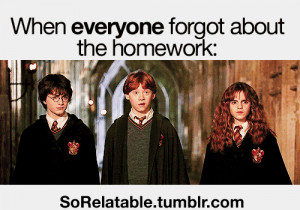
You are a GUI agent. You are given a task and a screenshot of the screen. Output one action in this format:
    pyautogui.click(x=<x>, y=<y>)
    Task: Click on the lights
    The image size is (300, 210).
    Given the screenshot: What is the action you would take?
    pyautogui.click(x=90, y=101), pyautogui.click(x=103, y=111), pyautogui.click(x=35, y=68)